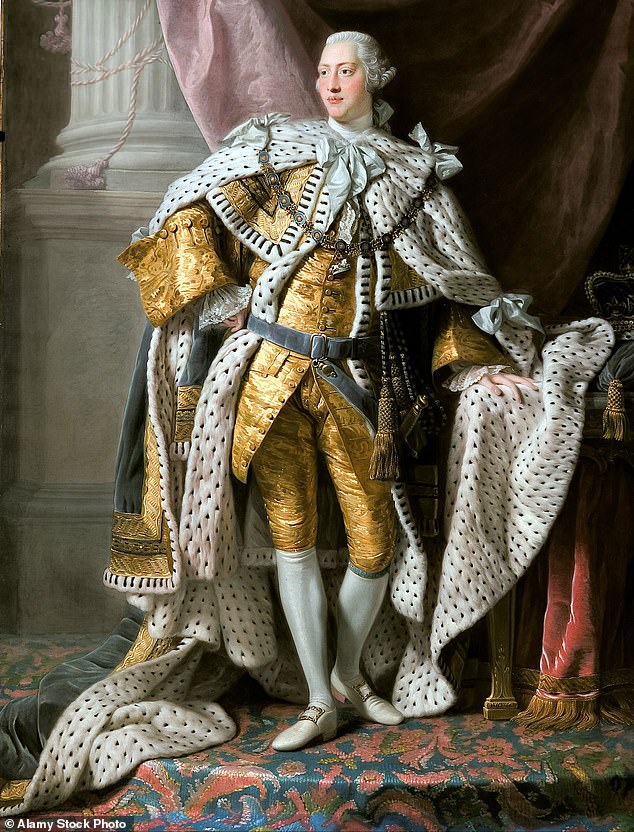
This screenshot has width=634, height=832. Find the location of `brown tassels on bottom of table cloth that king is leaning on`. brown tassels on bottom of table cloth that king is leaning on is located at coordinates 553,715.